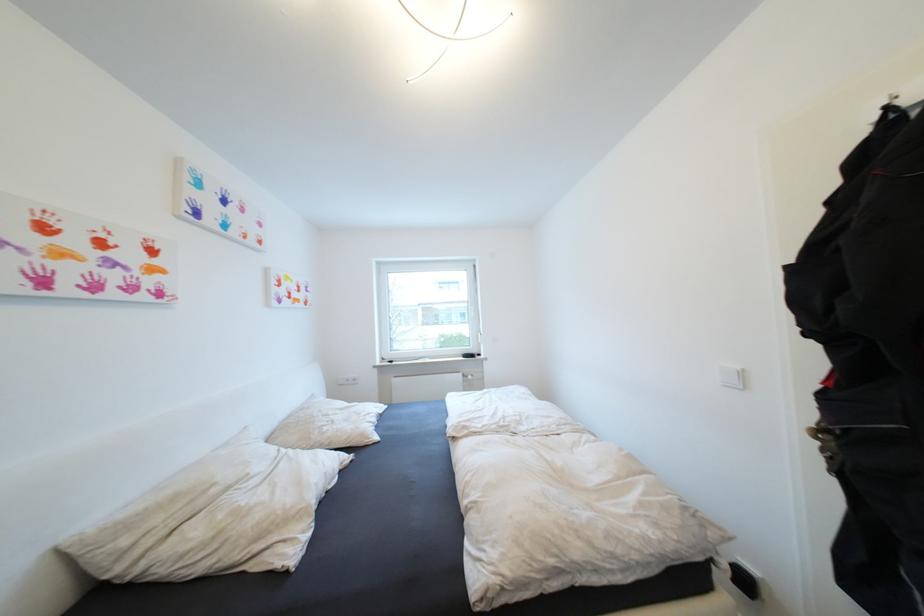
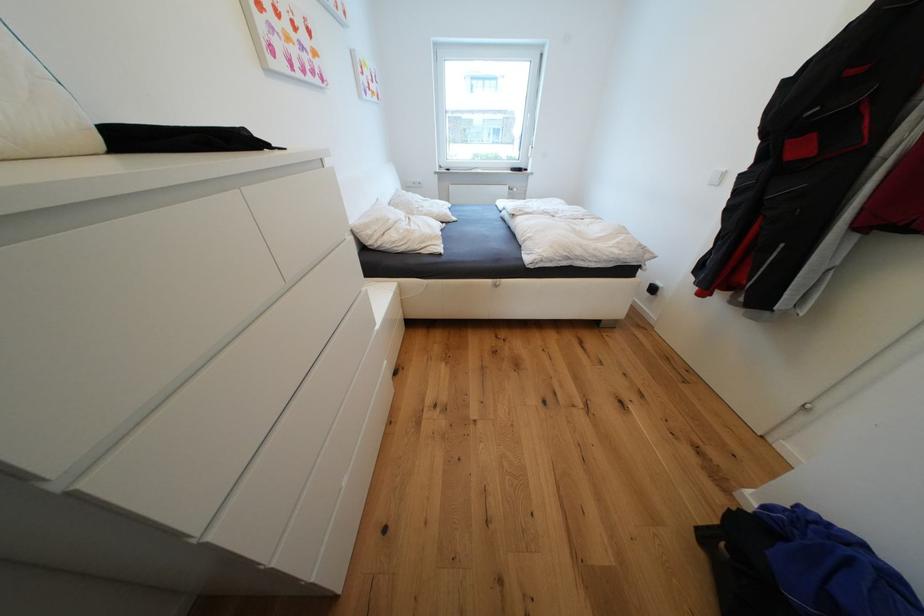
Find the pixel in the second image that matches [468,376] in the first image.

(515, 188)